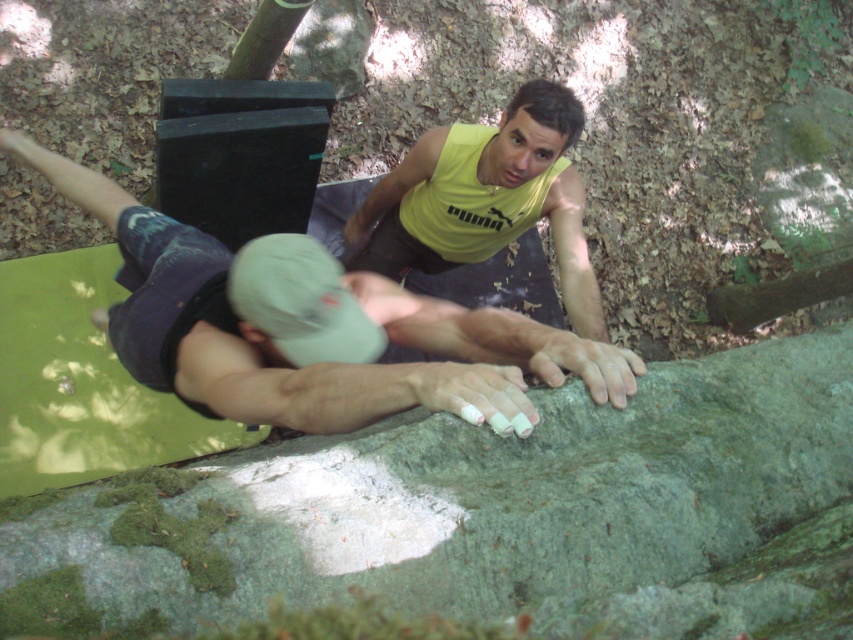
Who is positioned more to the left, matte gray climbing grip at center or yellow matte tank top at upper center?

matte gray climbing grip at center is more to the left.

Is point (408, 385) positioned before point (561, 109)?

Yes, point (408, 385) is in front of point (561, 109).

Identify the location of matte gray climbing grip at center. This screenshot has height=640, width=853. pyautogui.click(x=399, y=368).